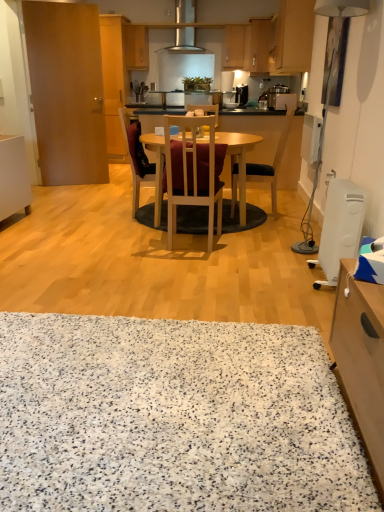
Question: Is wooden cabinet at upper right, the fifth cabinetry in the back-to-front sequence, surrounding white plastic heater at lower right, the 1th appliance ordered from the bottom?

Choices:
 (A) no
 (B) yes

Answer: (A)

Question: Does wooden cabinet at upper right, the second cabinetry positioned from the front, come in front of white plastic heater at lower right, the 2th appliance viewed from the top?

Choices:
 (A) yes
 (B) no

Answer: (B)

Question: From a real-world perspective, is wooden cabinet at upper right, which ranks as the 6th cabinetry in left-to-right order, physically below white plastic heater at lower right, the 1th appliance ordered from the bottom?

Choices:
 (A) yes
 (B) no

Answer: (B)

Question: Considering the relative sizes of wooden cabinet at upper right, the fifth cabinetry in the back-to-front sequence, and white plastic heater at lower right, the 1th appliance ordered from the bottom, in the image provided, is wooden cabinet at upper right, the fifth cabinetry in the back-to-front sequence, wider than white plastic heater at lower right, the 1th appliance ordered from the bottom,?

Choices:
 (A) no
 (B) yes

Answer: (B)

Question: From a real-world perspective, is wooden cabinet at upper right, the second cabinetry positioned from the front, positioned over white plastic heater at lower right, the 2th appliance viewed from the top, based on gravity?

Choices:
 (A) no
 (B) yes

Answer: (B)

Question: Is black plastic coffee machine at upper center in front of or behind black fabric chair at center, acting as the 1th chair starting from the right, in the image?

Choices:
 (A) behind
 (B) front

Answer: (A)

Question: Based on their sizes in the image, would you say black plastic coffee machine at upper center is bigger or smaller than black fabric chair at center, the third chair when ordered from left to right?

Choices:
 (A) big
 (B) small

Answer: (B)

Question: Considering the positions of black plastic coffee machine at upper center and black fabric chair at center, acting as the 1th chair starting from the right, in the image, is black plastic coffee machine at upper center wider or thinner than black fabric chair at center, acting as the 1th chair starting from the right,?

Choices:
 (A) wide
 (B) thin

Answer: (B)

Question: Visually, is black plastic coffee machine at upper center positioned to the left or to the right of black fabric chair at center, acting as the 1th chair starting from the right?

Choices:
 (A) right
 (B) left

Answer: (A)

Question: Considering the positions of brown wooden door at left and white speckled carpet at lower center in the image, is brown wooden door at left bigger or smaller than white speckled carpet at lower center?

Choices:
 (A) big
 (B) small

Answer: (B)

Question: In terms of height, does brown wooden door at left look taller or shorter compared to white speckled carpet at lower center?

Choices:
 (A) short
 (B) tall

Answer: (B)

Question: From the image's perspective, is brown wooden door at left positioned above or below white speckled carpet at lower center?

Choices:
 (A) below
 (B) above

Answer: (B)

Question: Is brown wooden door at left wider or thinner than white speckled carpet at lower center?

Choices:
 (A) thin
 (B) wide

Answer: (A)

Question: In terms of size, does black felt mat at center appear bigger or smaller than matte wood cabinet at upper center, arranged as the third cabinetry when viewed from the left?

Choices:
 (A) big
 (B) small

Answer: (B)

Question: From a real-world perspective, is black felt mat at center above or below matte wood cabinet at upper center, the sixth cabinetry viewed from the front?

Choices:
 (A) above
 (B) below

Answer: (B)